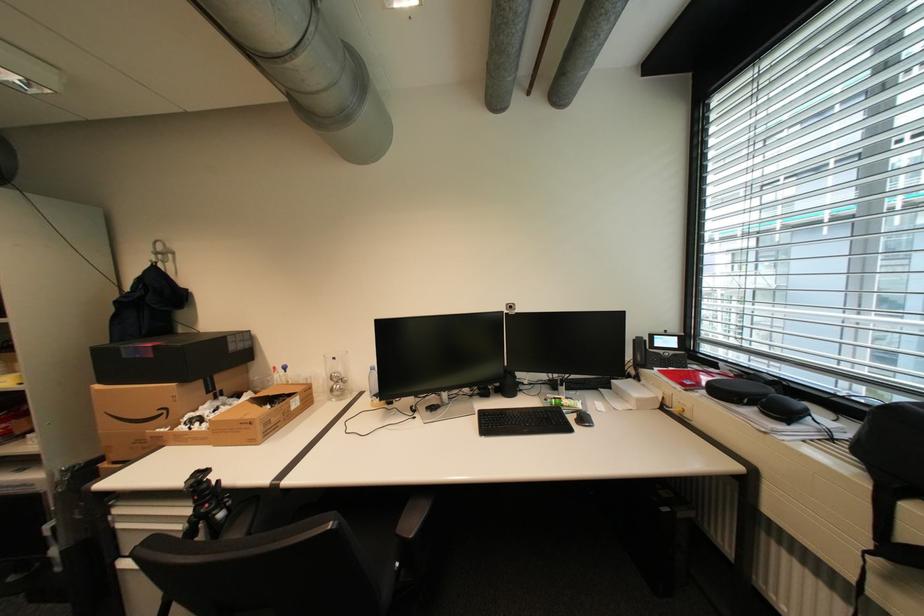
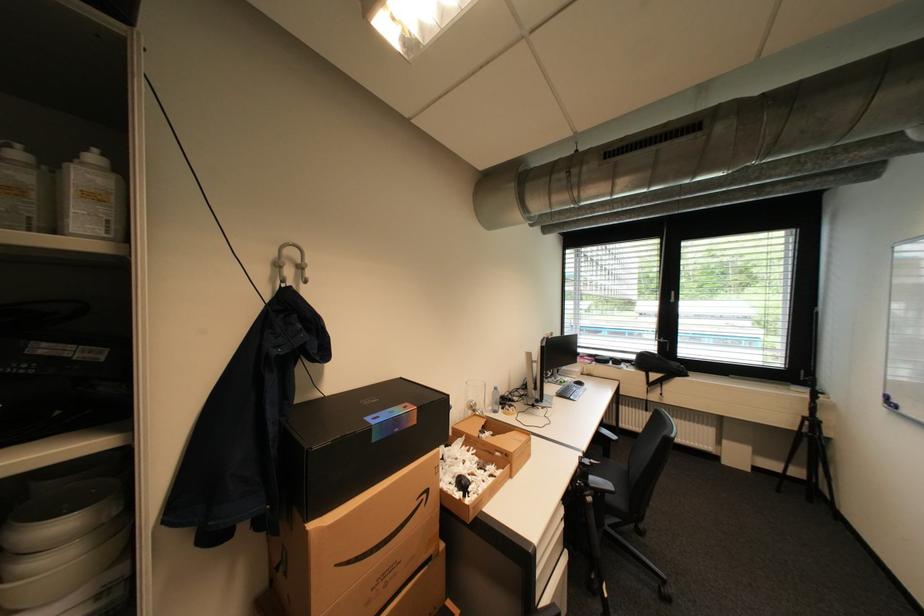
Where in the second image is the point corresponding to (x=149, y=286) from the first image?

(309, 326)